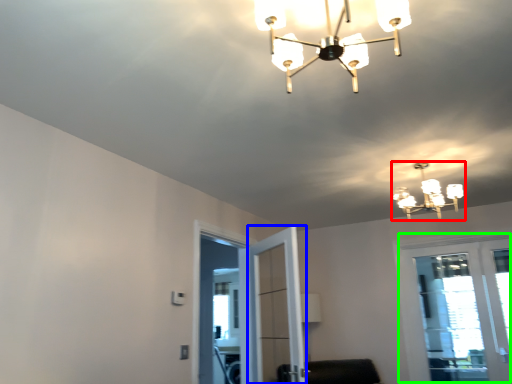
Question: Which is farther away from lamp (highlighted by a red box)? screen door (highlighted by a blue box) or window (highlighted by a green box)?

Choices:
 (A) screen door
 (B) window

Answer: (A)